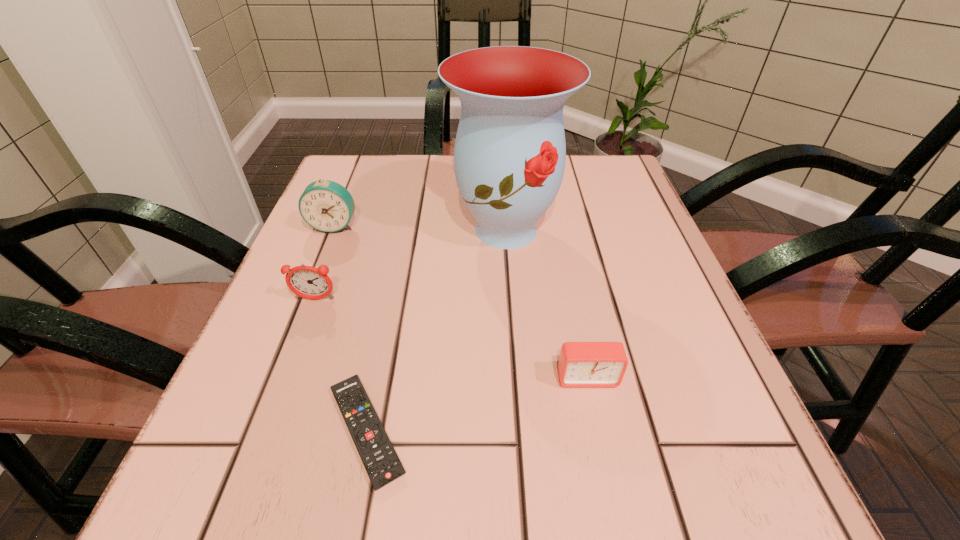
This screenshot has width=960, height=540. I want to click on free space located 0.310m on the front-facing side of the tallest alarm clock, so tap(281, 357).

Locate an element on the screen. vacant area located 0.210m on the front-facing side of the third nearest object is located at coordinates (273, 412).

Where is `free region located on the front-facing side of the rightmost alarm clock`? free region located on the front-facing side of the rightmost alarm clock is located at coordinates (614, 506).

Identify the location of free point located 0.140m on the right of the remote control. (516, 430).

The image size is (960, 540). In order to click on object that is at the far edge in this screenshot , I will do `click(509, 158)`.

Identify the location of object that is at the near edge. (382, 464).

Where is `remote control at the left edge`? Image resolution: width=960 pixels, height=540 pixels. remote control at the left edge is located at coordinates (382, 464).

Locate an element on the screen. This screenshot has width=960, height=540. object that is positioned at the right edge is located at coordinates (581, 364).

You are a GUI agent. You are given a task and a screenshot of the screen. Output one action in this format:
    pyautogui.click(x=<x>, y=<y>)
    Task: Click on the object at the near left corner
    The image size is (960, 540).
    Given the screenshot: What is the action you would take?
    pyautogui.click(x=382, y=464)

Where is `free region at the near edge`? free region at the near edge is located at coordinates (578, 460).